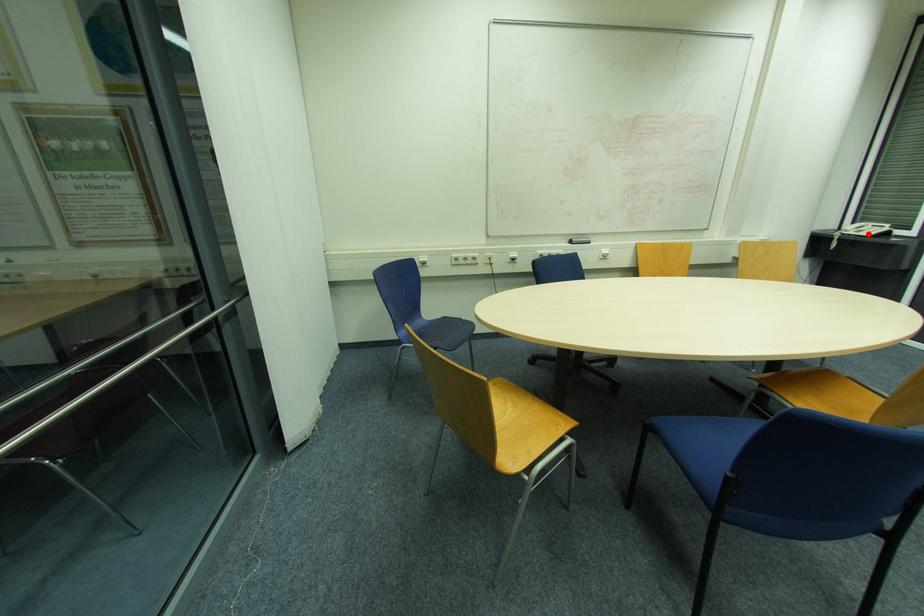
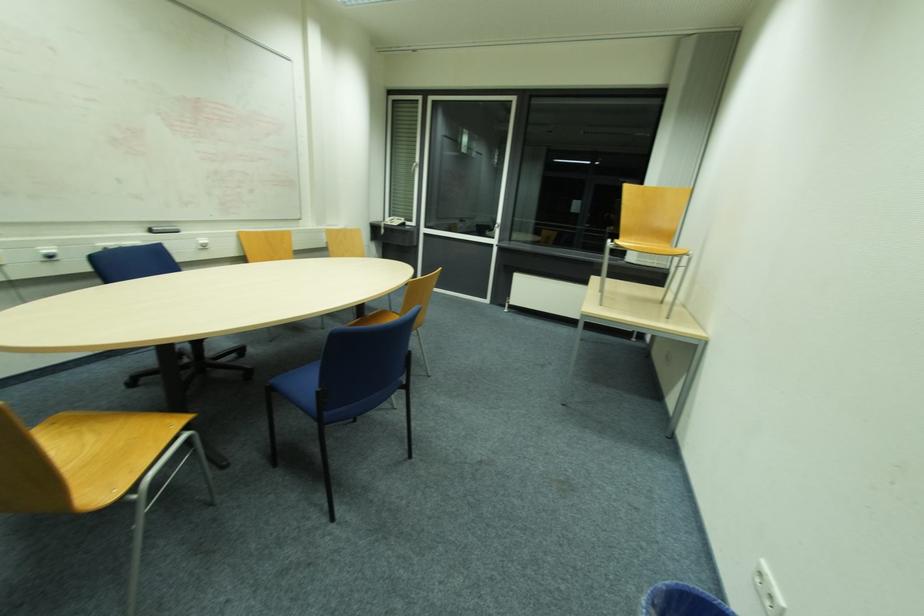
Find the pixel in the second image that matches the highlighted location in the first image.

(397, 225)